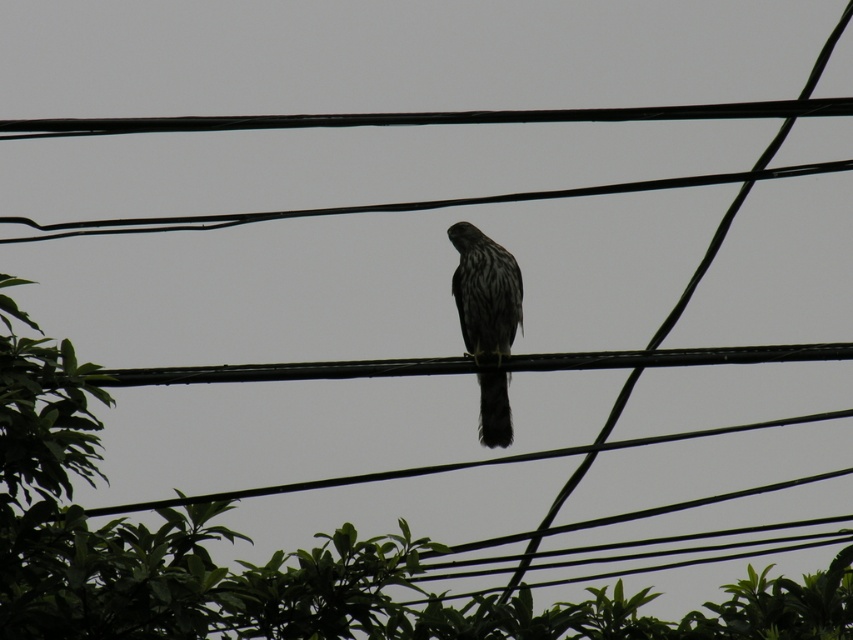
You are a birdwatcher observing the scene. You notice both the green leafy tree at center and the dark gray speckled falcon at center. Which object is positioned higher in the image?

The dark gray speckled falcon at center is positioned higher than the green leafy tree at center in the image.

You are a birdwatcher trying to capture a photo of the dark gray speckled falcon at center. You have a camera with a zoom lens that can focus on objects up to 25 inches away. Given the green leafy tree at center is between you and the falcon, will the tree block your view of the falcon?

The distance between the green leafy tree at center and the dark gray speckled falcon at center is 26.63 inches. Since the tree is closer to you than the falcon and the camera can focus up to 25 inches, the tree will block your view of the falcon because the total distance exceeds the camera range.

You are a bird flying towards the green leafy tree at center. Based on your current position, which direction should you head to reach the tree?

The green leafy tree at center is located at point 0.872 on the x axis and 0.321 on the y axis, so you should head towards the right and slightly downward direction to reach the tree.